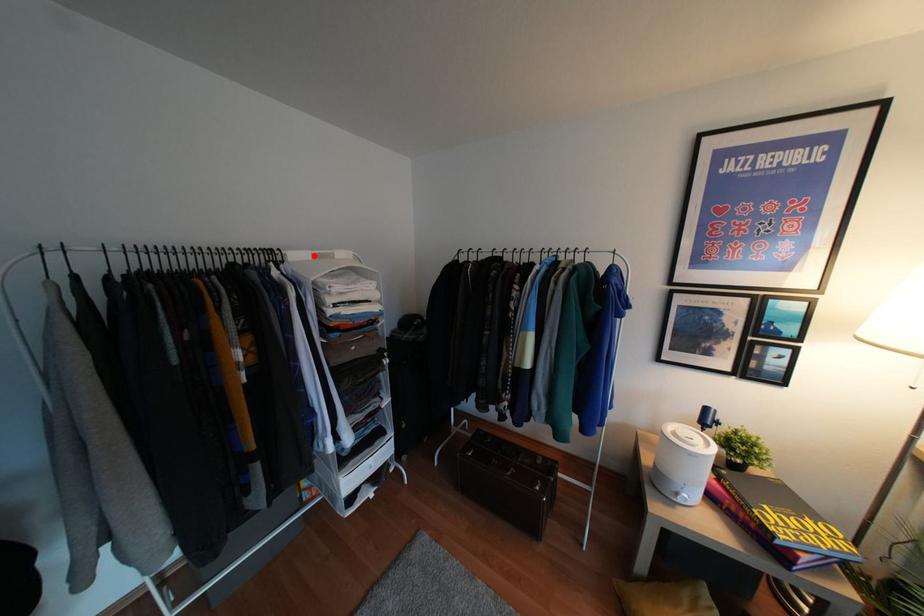
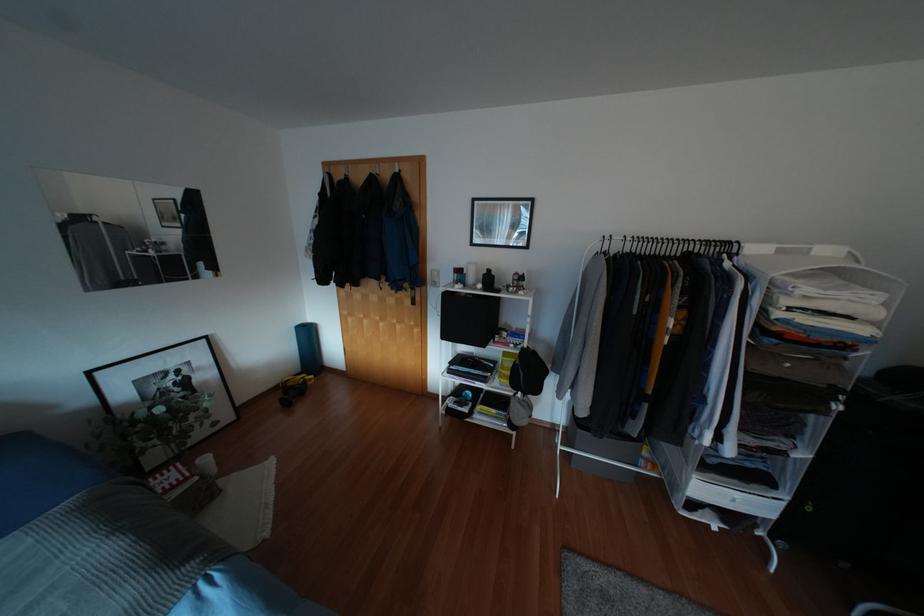
Where in the second image is the point corresponding to the highlighted location from the first image?

(779, 251)